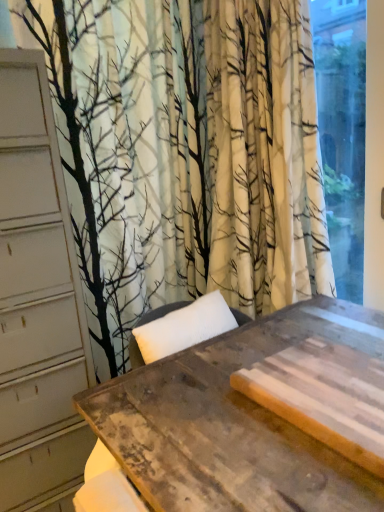
Question: Would you say rustic wood table at center is inside or outside transparent glass window at right?

Choices:
 (A) inside
 (B) outside

Answer: (B)

Question: In terms of width, does rustic wood table at center look wider or thinner when compared to transparent glass window at right?

Choices:
 (A) thin
 (B) wide

Answer: (B)

Question: Is rustic wood table at center in front of or behind transparent glass window at right in the image?

Choices:
 (A) front
 (B) behind

Answer: (A)

Question: Is point (339, 137) closer or farther from the camera than point (225, 437)?

Choices:
 (A) farther
 (B) closer

Answer: (A)

Question: Considering the positions of transparent glass window at right and rustic wood table at center in the image, is transparent glass window at right bigger or smaller than rustic wood table at center?

Choices:
 (A) big
 (B) small

Answer: (B)

Question: Would you say transparent glass window at right is to the left or to the right of rustic wood table at center in the picture?

Choices:
 (A) left
 (B) right

Answer: (B)

Question: From the image's perspective, relative to rustic wood table at center, is transparent glass window at right above or below?

Choices:
 (A) above
 (B) below

Answer: (A)